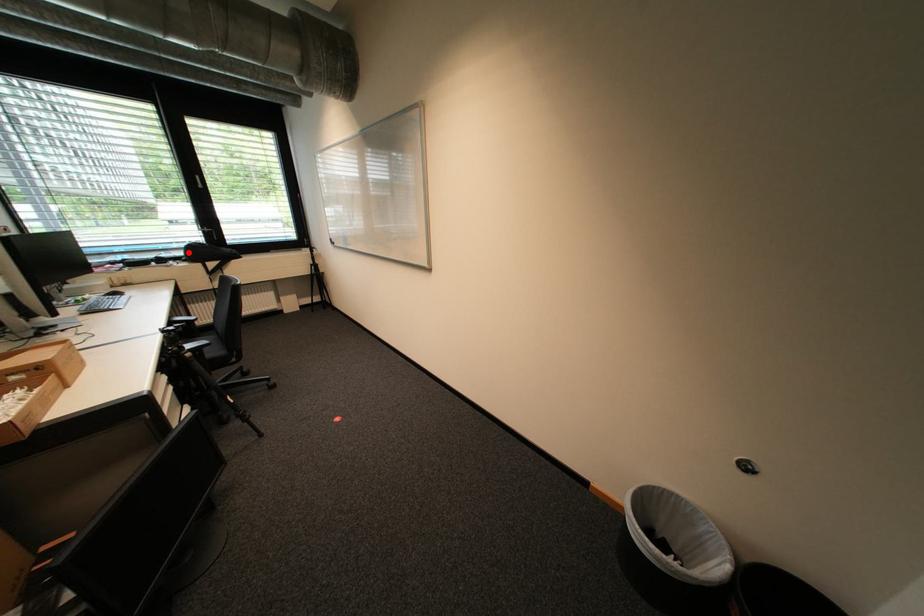
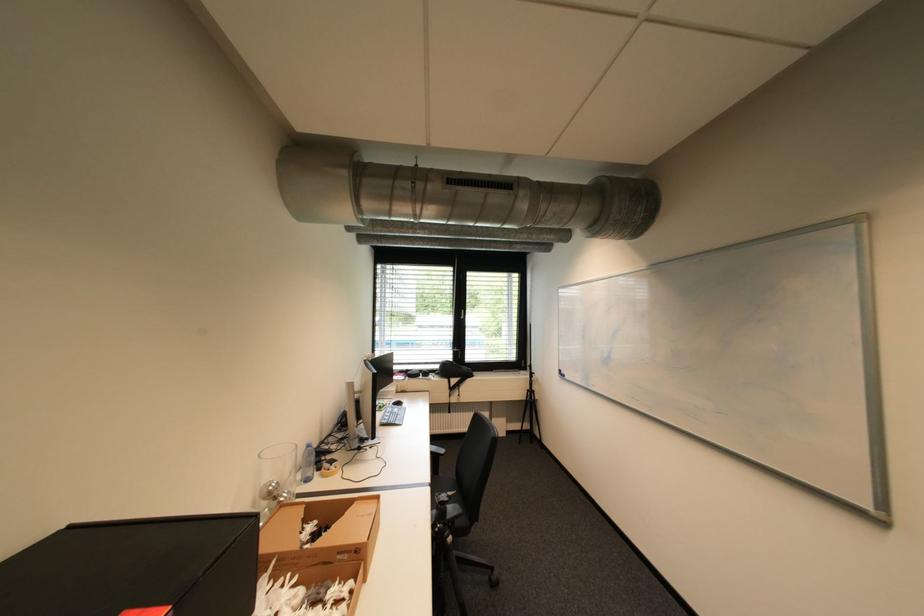
The point at the highlighted location is marked in the first image. Where is the corresponding point in the second image?

(445, 368)